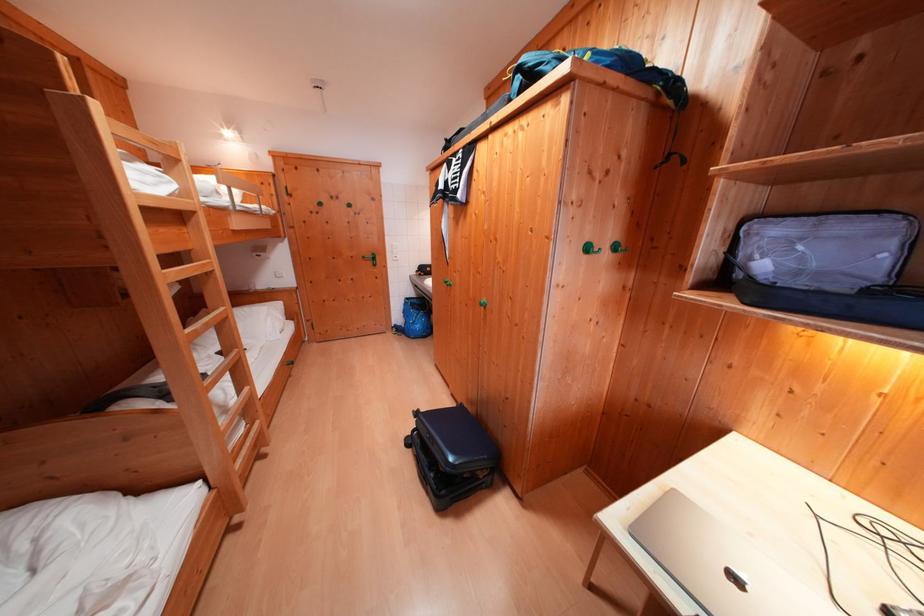
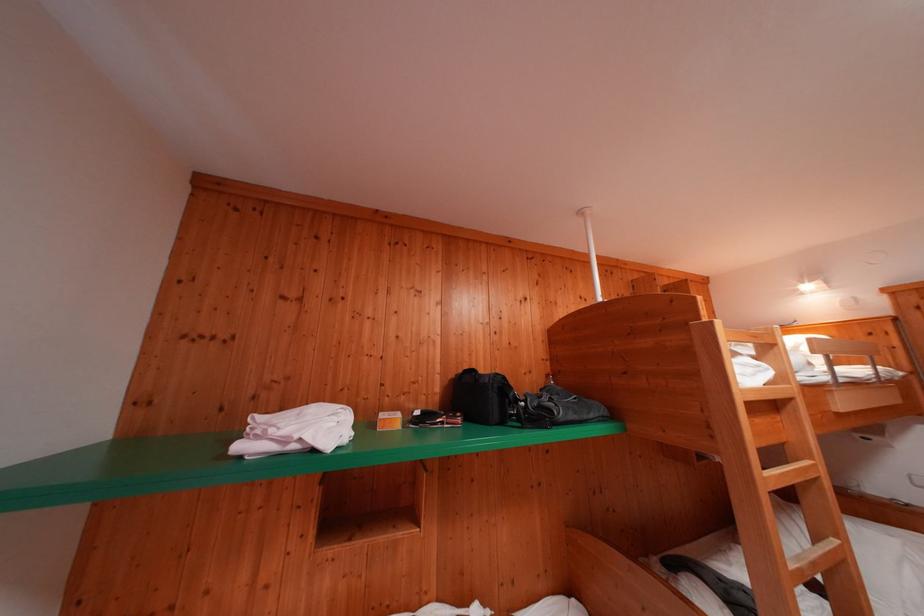
Question: The camera is either moving clockwise (left) or counter-clockwise (right) around the object. The first image is from the beginning of the video and the second image is from the end. Is the camera moving left or right when shooting the video?

Choices:
 (A) Left
 (B) Right

Answer: (B)